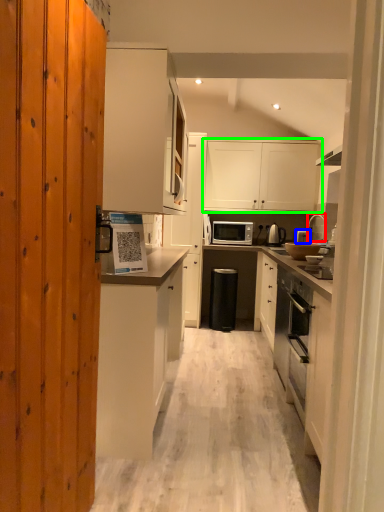
Question: Which is nearer to the faucet (highlighted by a red box)? appliance (highlighted by a blue box) or cabinetry (highlighted by a green box).

Choices:
 (A) appliance
 (B) cabinetry

Answer: (A)